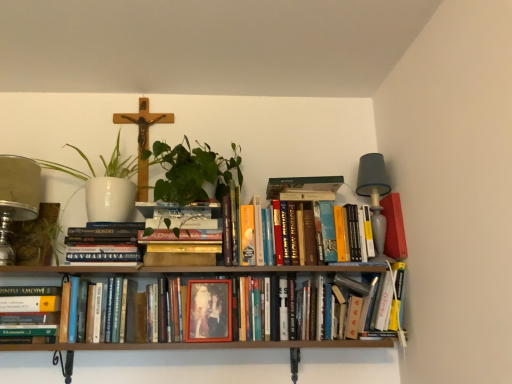
Find the location of a particular element. Image resolution: width=512 pixels, height=384 pixels. vacant area on top of wooden frame photo at center, which is the 3th book in left-to-right order (from a real-world perspective) is located at coordinates (x=238, y=273).